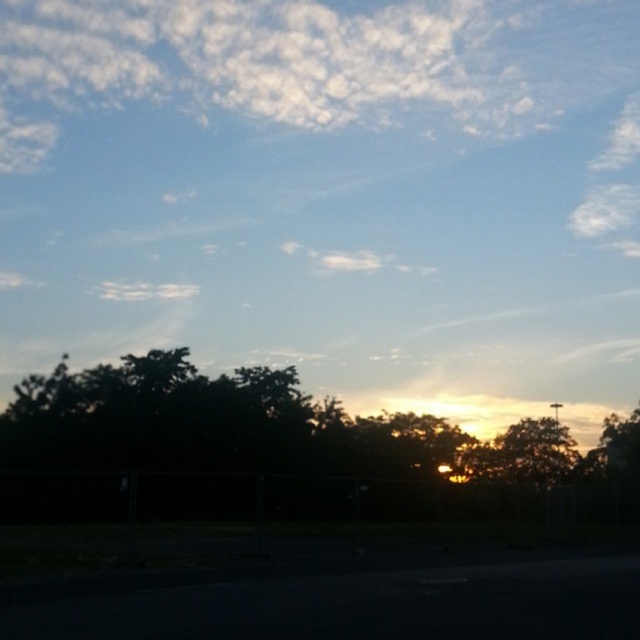
Between point (13, 488) and point (557, 408), which one is positioned in front?

Positioned in front is point (13, 488).

Can you confirm if dark green leafy tree at center is wider than metallic silver street sign at lower right?

Yes.

Identify the location of dark green leafy tree at center. The width and height of the screenshot is (640, 640). (300, 442).